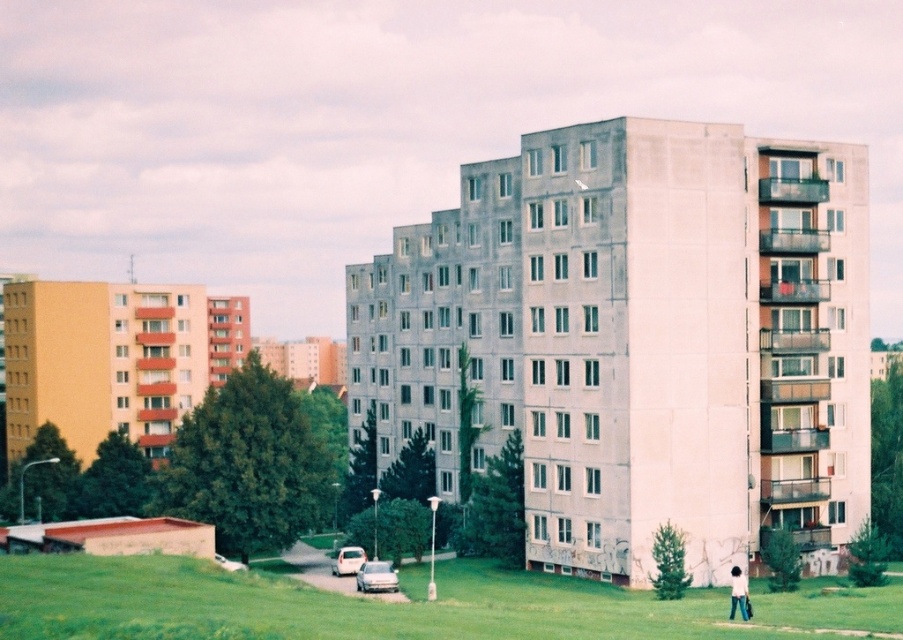
You are standing at the edge of the grassy area and want to walk to the light brown hair at lower right. Is the green grass at lower center between you and your destination?

Yes, the green grass at lower center is in front of the light brown hair at lower right, so it is between you and your destination.

In the scene shown: You are standing in the grassy area in front of the buildings and see two points marked on the ground. The first point is at coordinate point [328,595] and the second is at point [746,604]. Which point is closer to you?

Point [328,595] is closer to you because it is further to the camera than point [746,604].